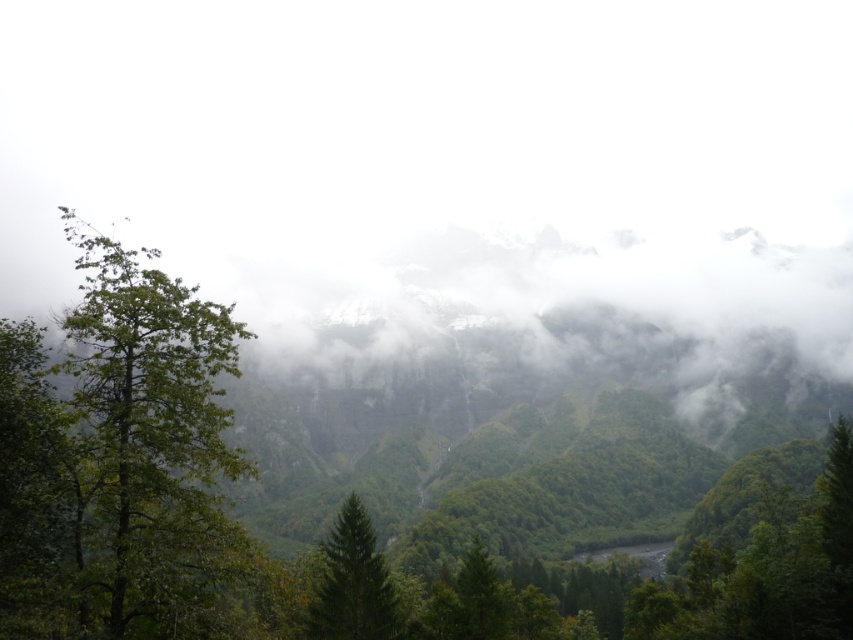
Does green leafy tree at left appear over green matte tree at center?

Yes.

Which is above, green leafy tree at left or green matte tree at center?

green leafy tree at left

Is point (230, 563) farther from viewer compared to point (332, 557)?

No, (230, 563) is closer to viewer.

The image size is (853, 640). What are the coordinates of `green leafy tree at left` in the screenshot? It's located at (151, 448).